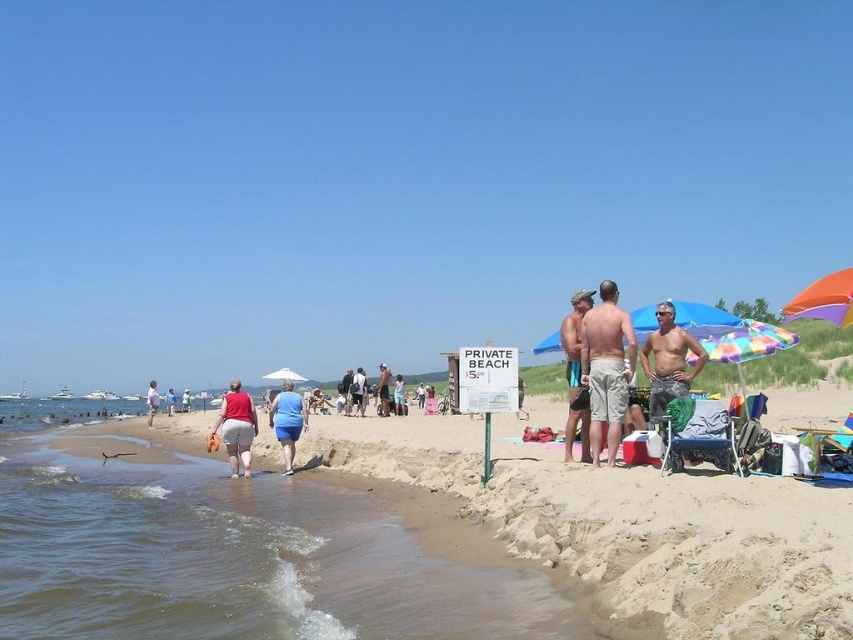
Question: Which is nearer to the blue cotton shorts at center?

Choices:
 (A) blue denim shorts at center
 (B) sandy beach at lower left

Answer: (B)

Question: Can you confirm if matte skin man at center is positioned above tan fabric shorts at center?

Choices:
 (A) no
 (B) yes

Answer: (B)

Question: Does matte red shorts at lower center have a smaller size compared to white fabric umbrella at center?

Choices:
 (A) no
 (B) yes

Answer: (B)

Question: Can you confirm if tan skin man at center is positioned above tan fabric shorts at center?

Choices:
 (A) yes
 (B) no

Answer: (A)

Question: Among these points, which one is nearest to the camera?

Choices:
 (A) (848, 305)
 (B) (383, 372)
 (C) (287, 371)

Answer: (A)

Question: Which of the following is the farthest from the observer?

Choices:
 (A) (340, 381)
 (B) (61, 513)
 (C) (231, 397)
 (D) (576, 365)

Answer: (A)